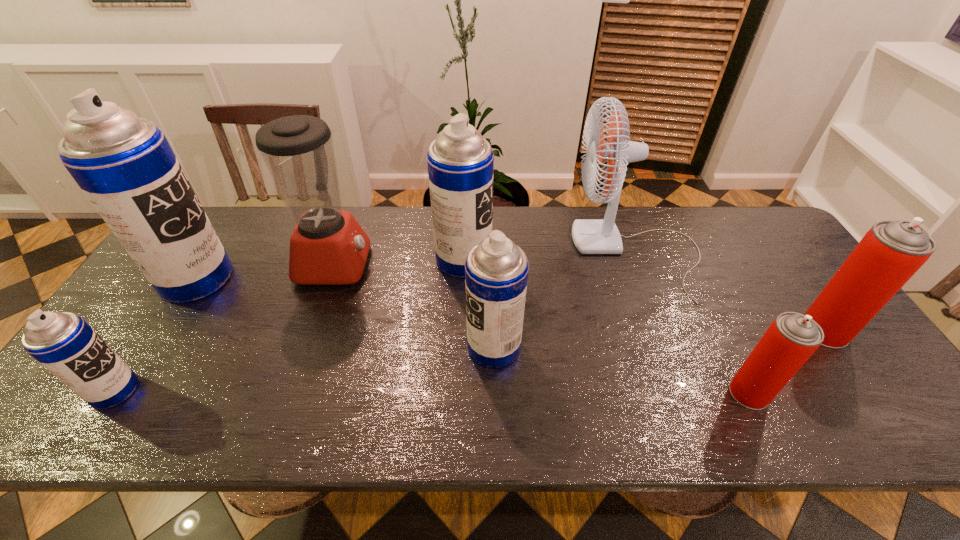
What are the coordinates of `free space at the right edge` in the screenshot? It's located at (774, 282).

The height and width of the screenshot is (540, 960). In the image, there is a desktop. Find the location of `vacant space at the far right corner`. vacant space at the far right corner is located at coordinates (759, 230).

Find the location of a particular element. Image resolution: width=960 pixels, height=540 pixels. vacant point located between the farther red aerosol can and the third farthest blue aerosol can is located at coordinates (660, 339).

The image size is (960, 540). I want to click on vacant space that is in between the second aerosol can from right to left and the fifth shortest aerosol can, so click(607, 327).

Locate an element on the screen. The image size is (960, 540). free space between the biggest blue aerosol can and the sixth object from right to left is located at coordinates (266, 271).

Find the location of a particular element. Image resolution: width=960 pixels, height=540 pixels. vacant area that lies between the smallest blue aerosol can and the biggest blue aerosol can is located at coordinates (156, 335).

Identify the location of unoccupied position between the rightmost object and the third object from left to right. (579, 297).

At what (x,y) coordinates should I click in order to perform the action: click on blank region between the second aerosol can from right to left and the orange fan. Please return your answer as a coordinate pair (x, y). The image size is (960, 540). Looking at the image, I should click on (693, 323).

Where is `free space between the rightmost object and the fan`? The image size is (960, 540). free space between the rightmost object and the fan is located at coordinates (x=732, y=292).

This screenshot has width=960, height=540. Find the location of `empty location between the nearest blue aerosol can and the tallest aerosol can`. empty location between the nearest blue aerosol can and the tallest aerosol can is located at coordinates (156, 335).